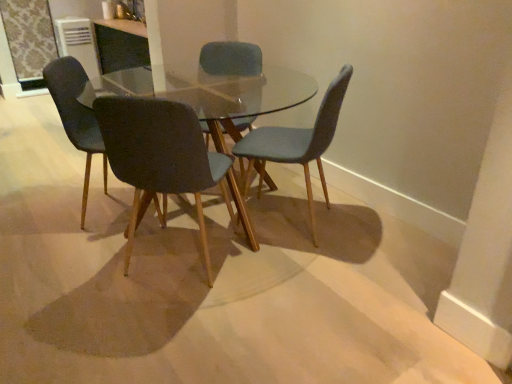
I want to click on free space in front of matte blue chair at center, marked as the first chair in a right-to-left arrangement, so click(x=302, y=273).